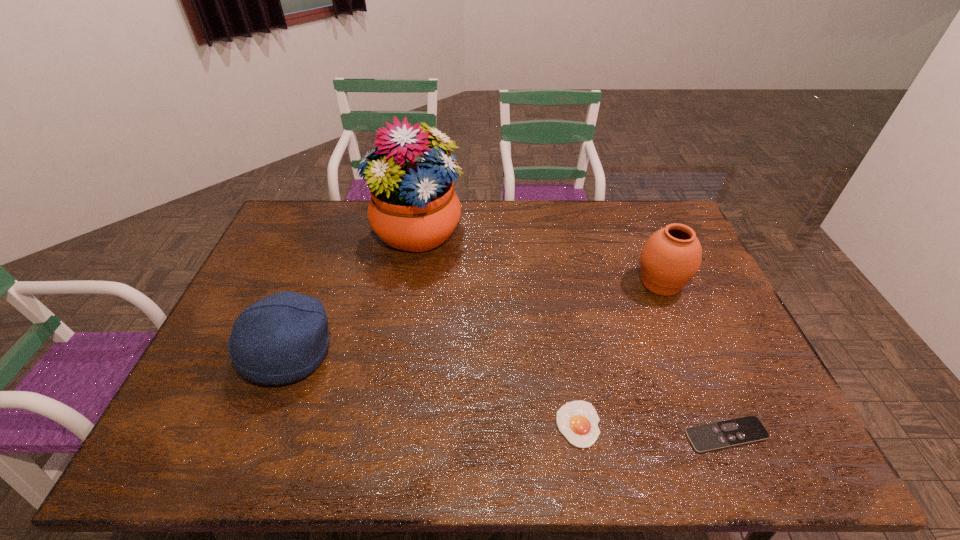
Find the location of `free space at the right edge of the desktop`. free space at the right edge of the desktop is located at coordinates (702, 279).

At what (x,y) coordinates should I click in order to perform the action: click on vacant space at the far left corner of the desktop. Please return your answer as a coordinate pair (x, y). Looking at the image, I should click on (307, 212).

Image resolution: width=960 pixels, height=540 pixels. I want to click on free space at the far right corner of the desktop, so click(x=630, y=204).

Locate an element on the screen. vacant space that is in between the remote control and the flower arrangement is located at coordinates (571, 334).

The height and width of the screenshot is (540, 960). In order to click on vacant area that lies between the third nearest object and the remote control in this screenshot , I will do (x=508, y=394).

The width and height of the screenshot is (960, 540). I want to click on vacant area between the third object from left to right and the tallest object, so click(497, 329).

Where is `blank region between the flower arrangement and the third farthest object`? blank region between the flower arrangement and the third farthest object is located at coordinates (353, 293).

The width and height of the screenshot is (960, 540). In order to click on blank region between the flower arrangement and the urn in this screenshot , I will do `click(539, 258)`.

The image size is (960, 540). I want to click on vacant region between the skullcap and the tallest object, so tap(353, 293).

I want to click on vacant space that is in between the third nearest object and the flower arrangement, so click(x=353, y=293).